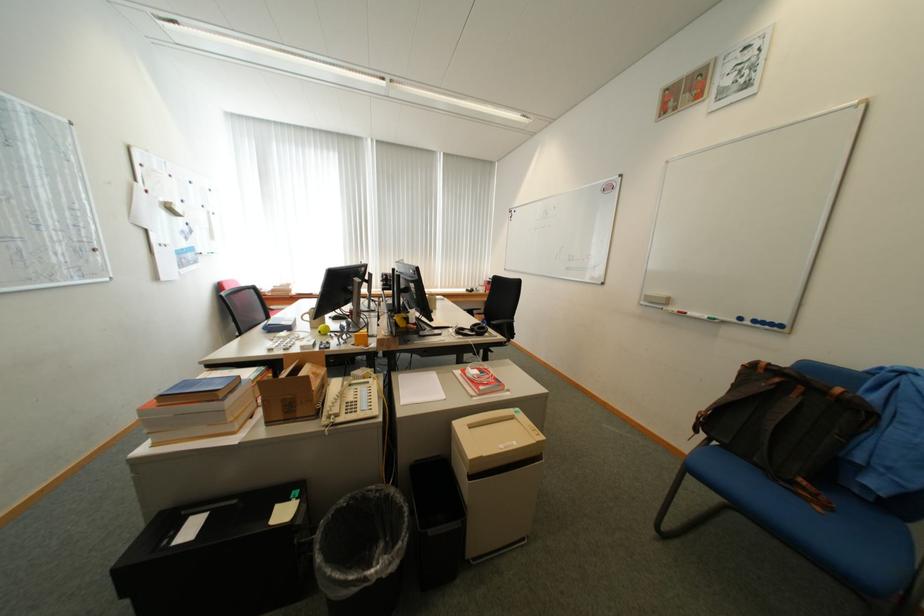
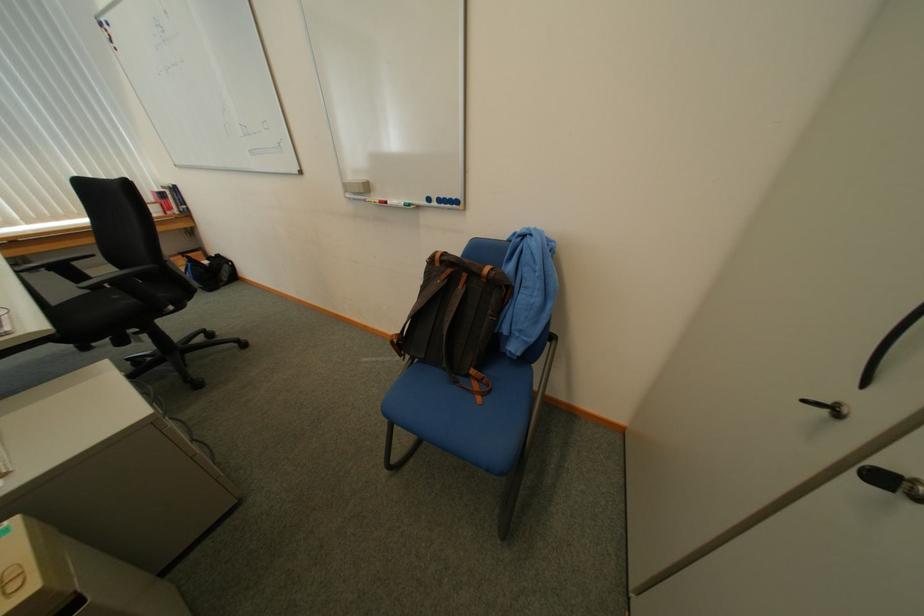
Where in the second image is the point corresponding to point (827, 509) from the first image?

(489, 400)